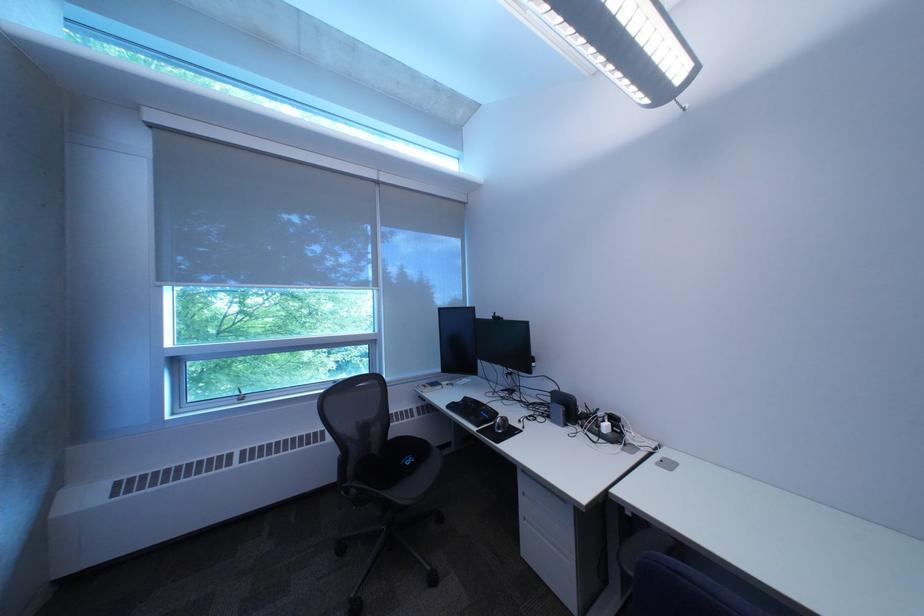
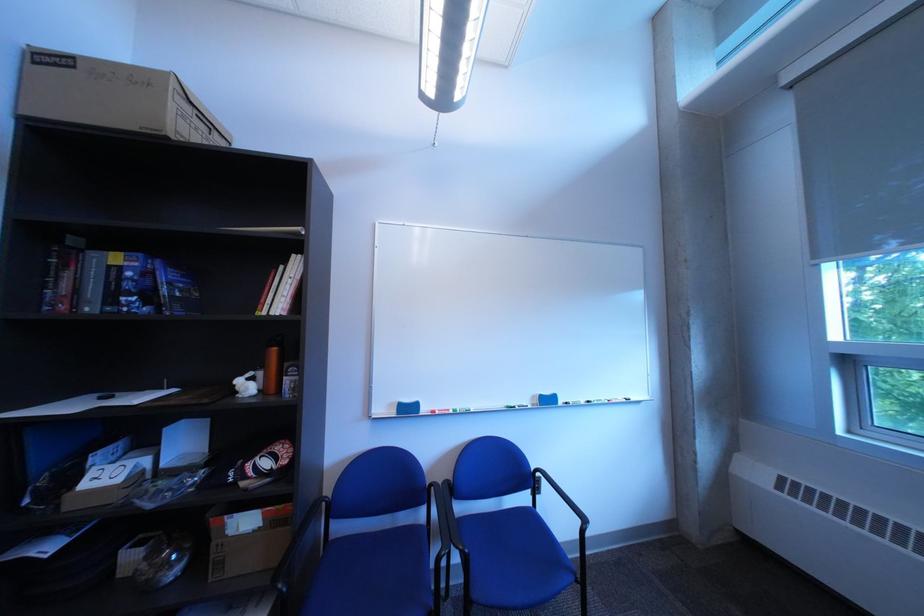
Question: Based on the continuous images, in which direction is the camera rotating? Reply with the corresponding letter.

Choices:
 (A) Left
 (B) Right
 (C) Up
 (D) Down

Answer: (A)